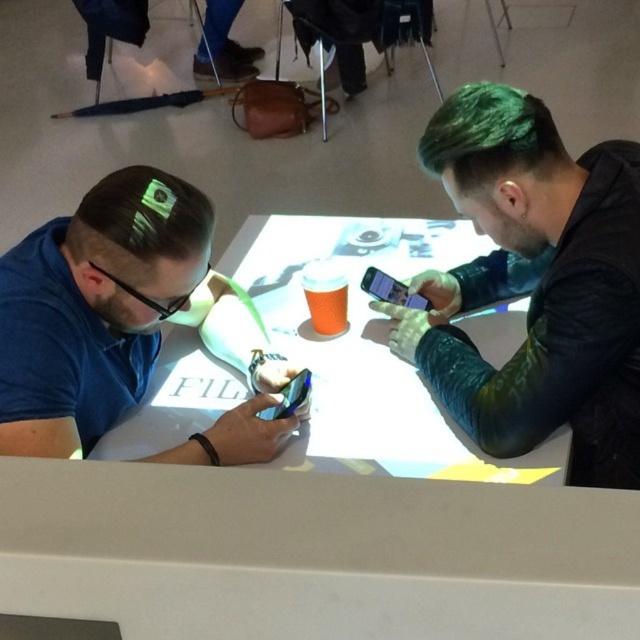
Question: Based on their relative distances, which object is nearer to the black matte glasses at left?

Choices:
 (A) shiny black phone at center
 (B) brown matte hair at center

Answer: (B)

Question: Which point is farther to the camera?

Choices:
 (A) (x=612, y=356)
 (B) (x=496, y=115)

Answer: (B)

Question: In this image, where is white glossy table at center located relative to black matte glasses at left?

Choices:
 (A) above
 (B) below

Answer: (B)

Question: Which of these objects is positioned closest to the black matte glasses at left?

Choices:
 (A) brown matte hair at center
 (B) green dyed hair at upper right
 (C) green hair at right
 (D) blue matte shirt at left

Answer: (A)

Question: Can you confirm if blue matte shirt at left is positioned below white glossy table at center?

Choices:
 (A) no
 (B) yes

Answer: (B)

Question: Is the position of white glossy table at center more distant than that of shiny black phone at center?

Choices:
 (A) yes
 (B) no

Answer: (B)